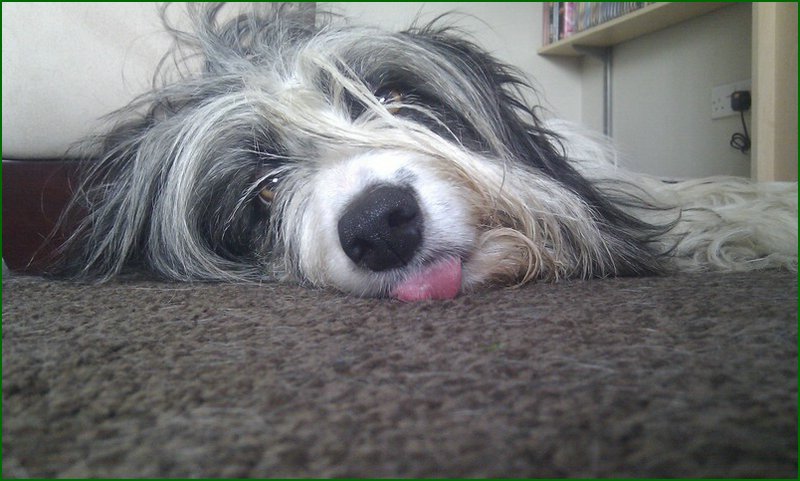
Where is `outlet`? outlet is located at coordinates (718, 110).